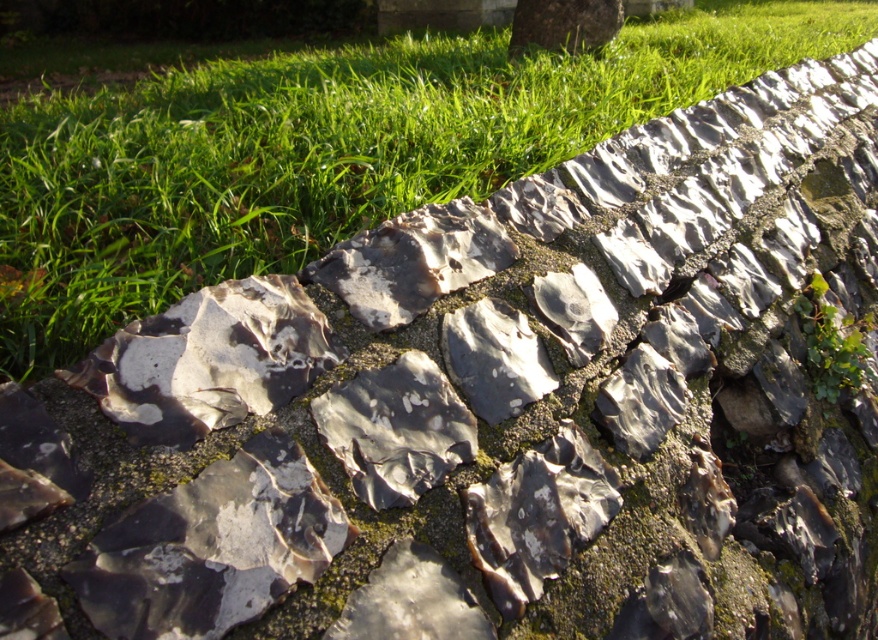
Does green grass at upper center have a lesser width compared to green leafy tree at upper center?

No, green grass at upper center is not thinner than green leafy tree at upper center.

Who is more distant from viewer, (707,61) or (522,36)?

The point (522,36) is behind.

Who is more distant from viewer, (722, 60) or (517, 44)?

Point (517, 44)

Image resolution: width=878 pixels, height=640 pixels. Find the location of `green grass at upper center`. green grass at upper center is located at coordinates (325, 152).